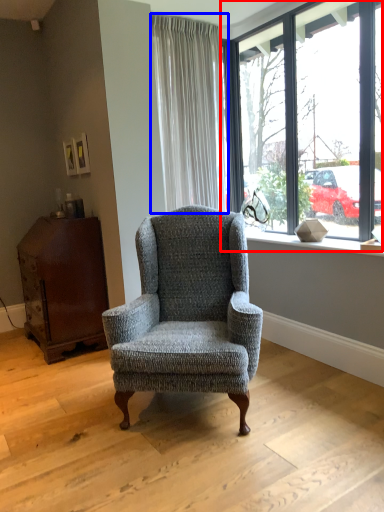
Question: Which object is closer to the camera taking this photo, window (highlighted by a red box) or curtain (highlighted by a blue box)?

Choices:
 (A) window
 (B) curtain

Answer: (A)